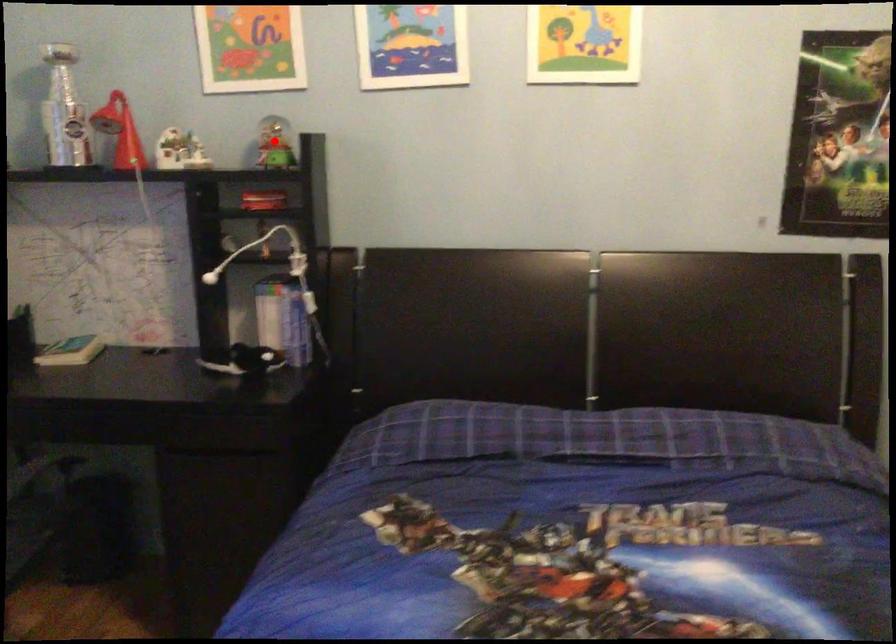
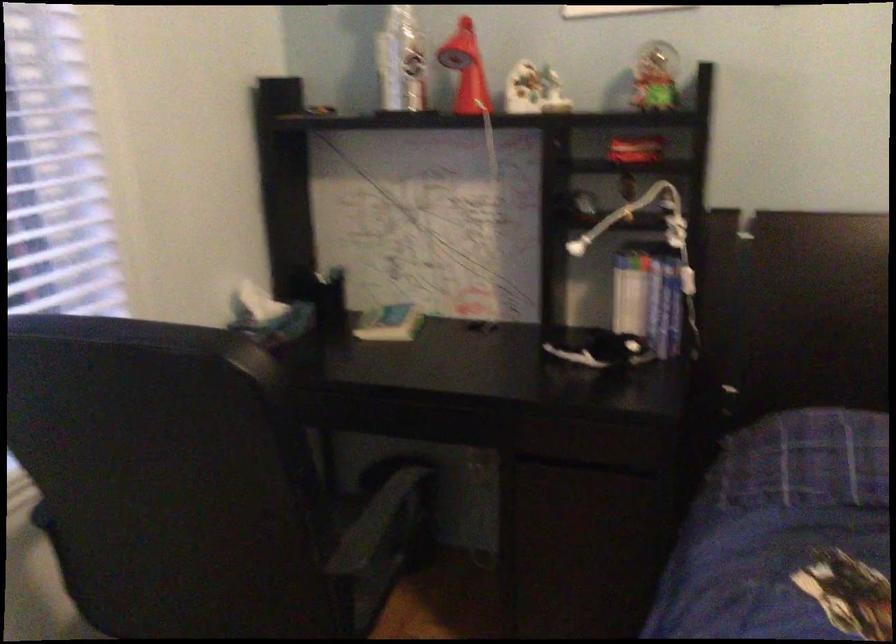
Question: I am providing you with two images of the same scene from different viewpoints. Image1 has a red point marked. In image2, the corresponding 3D location appears at what relative position? Reply with the corresponding letter.

Choices:
 (A) Closer
 (B) Farther

Answer: (A)